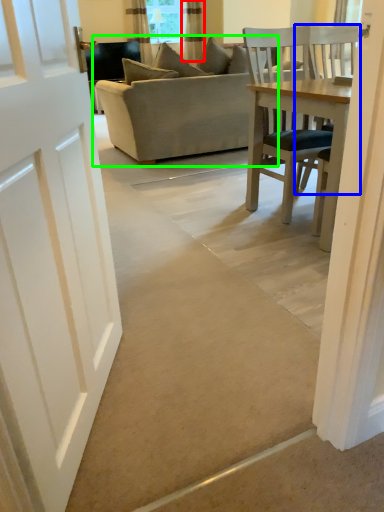
Question: Which object is the closest to the curtain (highlighted by a red box)? Choose among these: chair (highlighted by a blue box) or studio couch (highlighted by a green box).

Choices:
 (A) chair
 (B) studio couch

Answer: (B)